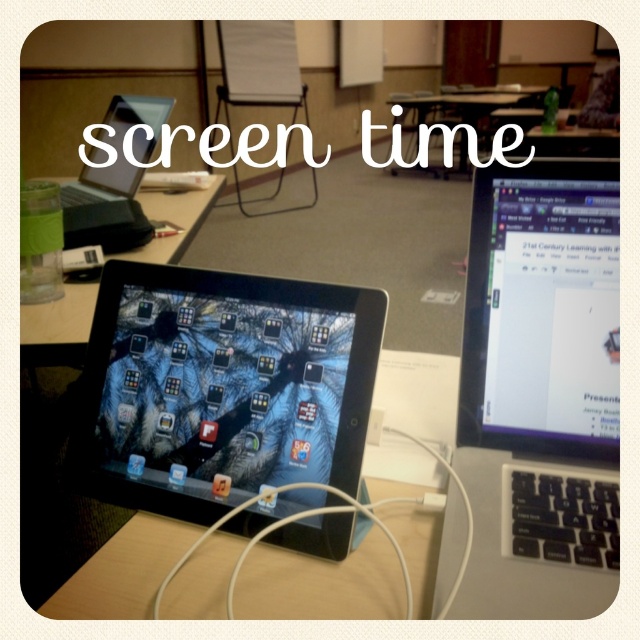
Question: Among these points, which one is farthest from the camera?

Choices:
 (A) (396, 129)
 (B) (92, 243)
 (C) (198, 214)

Answer: (A)

Question: Is sleek black laptop at right closer to the viewer compared to wooden table at center?

Choices:
 (A) yes
 (B) no

Answer: (A)

Question: Which object is positioned farthest from the matte black tablet at center?

Choices:
 (A) clear plastic water bottle at upper left
 (B) sleek black laptop at right

Answer: (B)

Question: Can you confirm if matte black tablet at center is bigger than wooden table at center?

Choices:
 (A) yes
 (B) no

Answer: (B)

Question: Which object is the farthest from the clear plastic water bottle at upper left?

Choices:
 (A) wooden table at center
 (B) sleek black laptop at right
 (C) matte black tablet at center

Answer: (A)

Question: Is clear plastic water bottle at upper left in front of wooden table at center?

Choices:
 (A) yes
 (B) no

Answer: (A)